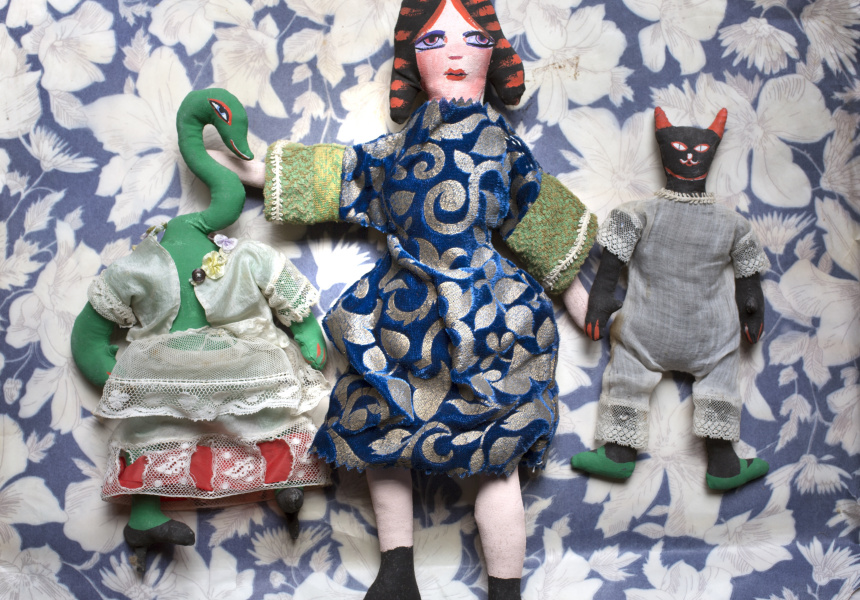
Identify the location of curtain. (667, 44).